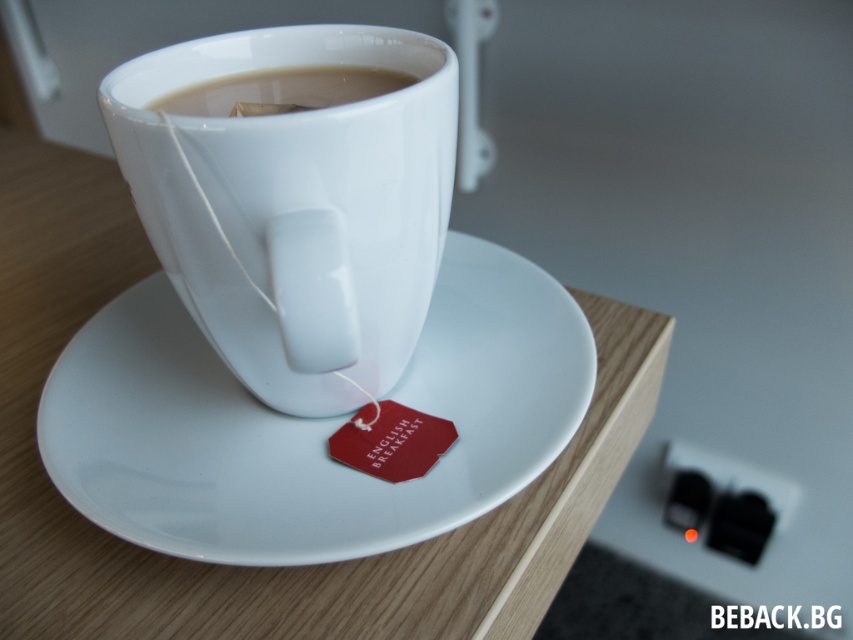
You are taking a photo of the cup and saucer. Which point, point (283,378) or point (233,76), is closer to your camera lens?

Point (283,378) is closer to the camera lens than point (233,76).

You are a photographer trying to capture the cup and saucer arrangement. You notice two points in the scene at coordinates point [434,70] and point [267,506]. Which point is closer to your camera lens?

Point [434,70] is further to the camera than point [267,506], so the point closer to the camera lens is point [267,506].

You are a delivery robot navigating through a kitchen. You need to place a package on the table where the white ceramic cup is located. The cup is at coordinates point (294, 198). Can you safely place the package on the table without knocking over the cup?

The point (294, 198) indicates the white glossy mug at center, so placing the package near that location might risk knocking over the cup. Choose a spot further away from the cup to ensure safety.